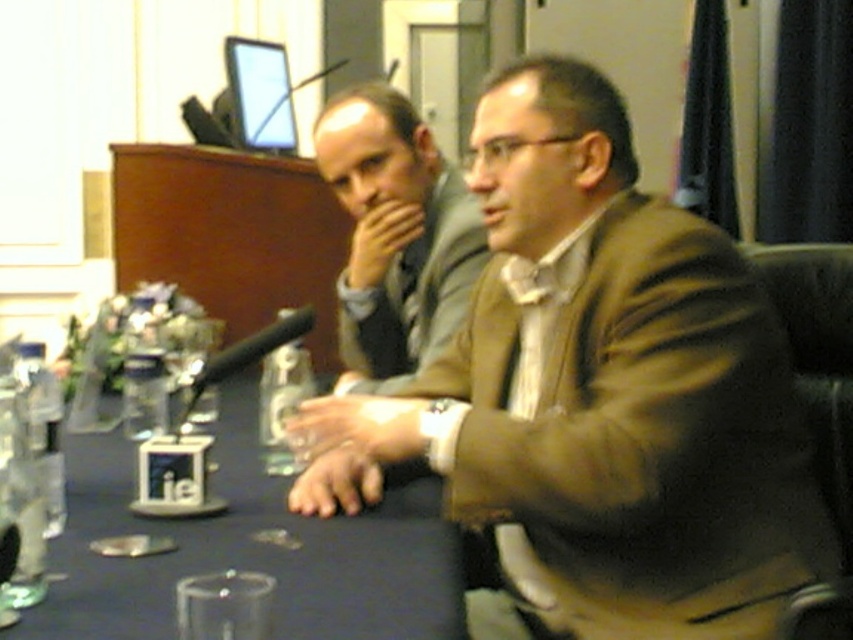
What do you see at coordinates (248, 550) in the screenshot?
I see `blue fabric table at center` at bounding box center [248, 550].

Is blue fabric table at center to the left of matte gray suit at center from the viewer's perspective?

Correct, you'll find blue fabric table at center to the left of matte gray suit at center.

This screenshot has height=640, width=853. Identify the location of blue fabric table at center. (248, 550).

In order to click on blue fabric table at center in this screenshot , I will do `click(248, 550)`.

Consider the image. Is the position of matte brown jacket at center less distant than that of blue fabric table at center?

No, matte brown jacket at center is further to the viewer.

Does matte brown jacket at center have a lesser height compared to blue fabric table at center?

No, matte brown jacket at center is not shorter than blue fabric table at center.

The height and width of the screenshot is (640, 853). What are the coordinates of `matte brown jacket at center` in the screenshot? It's located at (596, 396).

Identify the location of matte brown jacket at center. (596, 396).

Which is above, matte brown jacket at center or matte gray suit at center?

matte gray suit at center is higher up.

Between matte brown jacket at center and matte gray suit at center, which one has less height?

Standing shorter between the two is matte gray suit at center.

Between point (555, 96) and point (331, 182), which one is positioned behind?

The point (331, 182) is behind.

What are the coordinates of `matte brown jacket at center` in the screenshot? It's located at coord(596,396).